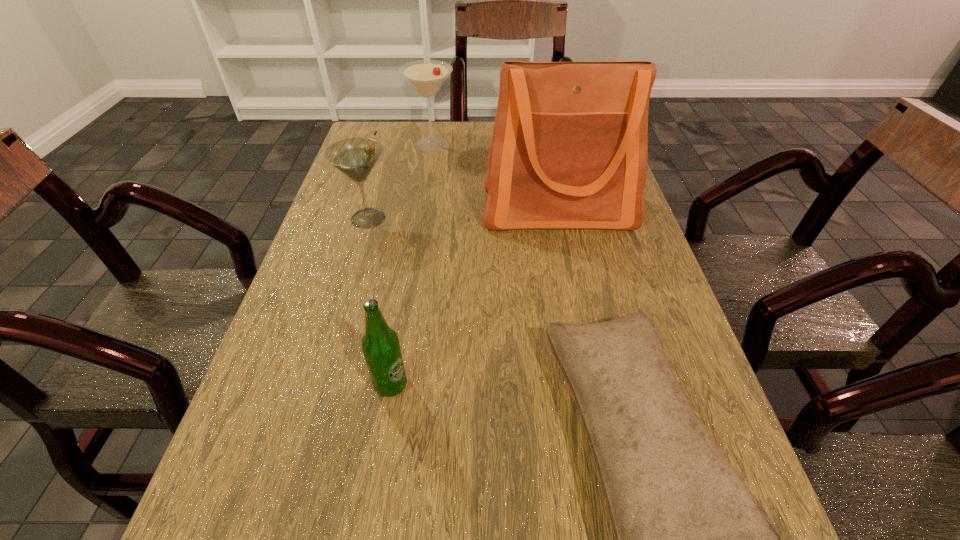
Identify the location of the tallest object. (569, 147).

Find the location of a particular element. The image size is (960, 540). the farther martini is located at coordinates (426, 76).

In order to click on the nearer martini in this screenshot , I will do `click(355, 157)`.

At what (x,y) coordinates should I click in order to perform the action: click on beer bottle. Please return your answer as a coordinate pair (x, y). This screenshot has height=540, width=960. Looking at the image, I should click on (380, 344).

Where is `free location located 0.120m on the front pocket of the tallest object`? free location located 0.120m on the front pocket of the tallest object is located at coordinates (571, 274).

Image resolution: width=960 pixels, height=540 pixels. I want to click on free space located 0.280m on the front of the farthest object, so point(420,216).

Where is `blank space located on the back of the nearer martini`? The height and width of the screenshot is (540, 960). blank space located on the back of the nearer martini is located at coordinates (390, 145).

In order to click on vacant region located on the label of the beer bottle in this screenshot , I will do `click(462, 384)`.

Locate an element on the screen. The image size is (960, 540). object present at the far edge is located at coordinates (426, 76).

In order to click on object present at the right edge in this screenshot , I will do `click(569, 147)`.